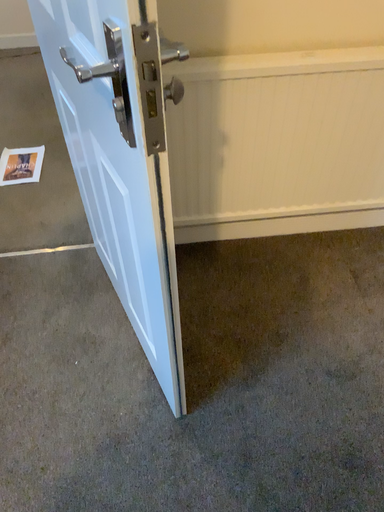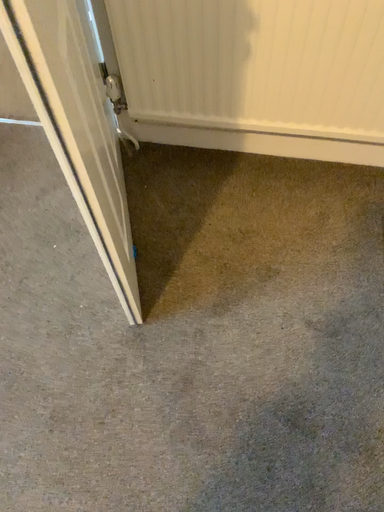
Question: Which way did the camera rotate in the video?

Choices:
 (A) rotated downward
 (B) rotated upward

Answer: (A)